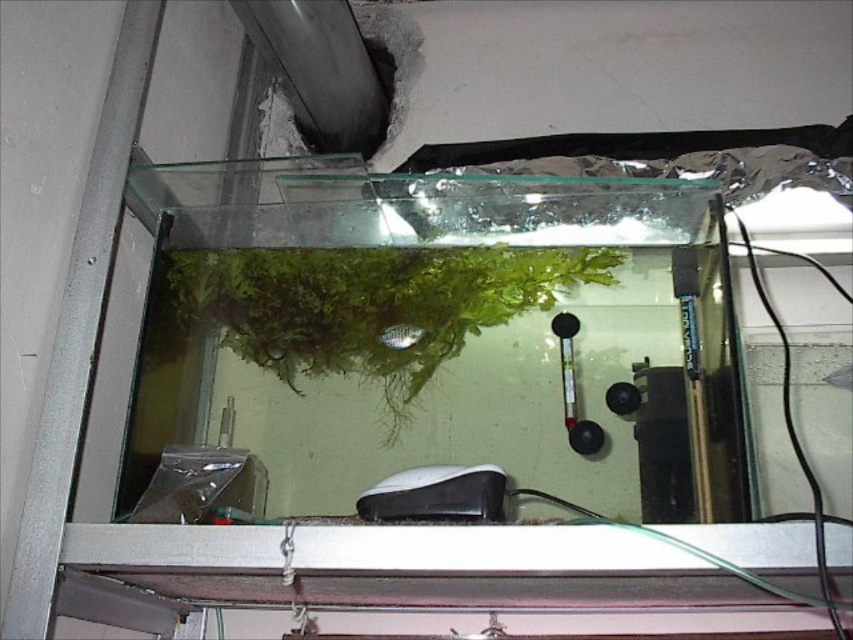
You are an aquarium maintenance worker who needs to check the water temperature. You have a thermometer attached to the left side of the tank. To reach the thermometer, you must avoid stepping on the green matte plant at center and the green matte fish at center. Which object should you avoid stepping on first?

The green matte plant at center is located above the green matte fish at center, so you should avoid stepping on the green matte plant at center first as it is higher up and closer to your reach.

You are an aquatic plant caretaker who needs to adjust the air pump. You see the white matte air pump at bottom and the green matte fish at center. Which object is taller?

The white matte air pump at bottom is much taller than the green matte fish at center.

You are an aquarium technician inspecting the tank. You need to adjust the white matte air pump at bottom, but you must avoid disturbing the green matte plant at center. Is the air pump accessible without moving the plant?

The green matte plant at center is above the white matte air pump at bottom, so you can adjust the air pump without moving the plant since it is positioned below the plant.